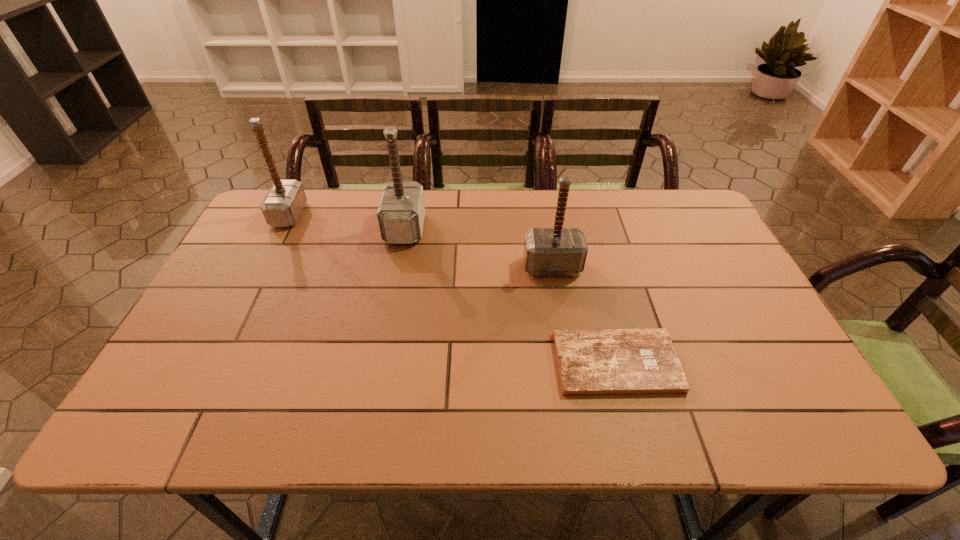
This screenshot has width=960, height=540. Identify the location of the second hammer from left to right. (401, 212).

Locate an element on the screen. Image resolution: width=960 pixels, height=540 pixels. the leftmost hammer is located at coordinates (282, 206).

The width and height of the screenshot is (960, 540). Find the location of `the rightmost hammer`. the rightmost hammer is located at coordinates (557, 251).

You are a GUI agent. You are given a task and a screenshot of the screen. Output one action in this format:
    pyautogui.click(x=<x>, y=<y>)
    Task: Click on the second nearest object
    
    Given the screenshot: What is the action you would take?
    pyautogui.click(x=557, y=251)

Identify the location of the nearest object. (605, 361).

You are a GUI agent. You are given a task and a screenshot of the screen. Output one action in this format:
    pyautogui.click(x=<x>, y=<y>)
    Task: Click on the shortest object
    The width and height of the screenshot is (960, 540).
    Given the screenshot: What is the action you would take?
    pyautogui.click(x=605, y=361)

Find the location of a particular element. This screenshot has width=960, height=540. vacant region located for striking with the head of the second hammer from left to right is located at coordinates (514, 228).

Where is `free point located on the striking surface of the leftmost object`? The height and width of the screenshot is (540, 960). free point located on the striking surface of the leftmost object is located at coordinates (334, 215).

Find the location of a particular element. This screenshot has height=540, width=960. free region located 0.280m on the back of the third farthest object is located at coordinates (540, 200).

This screenshot has width=960, height=540. Identify the location of vacant area situated 0.150m on the back of the Bible. (595, 290).